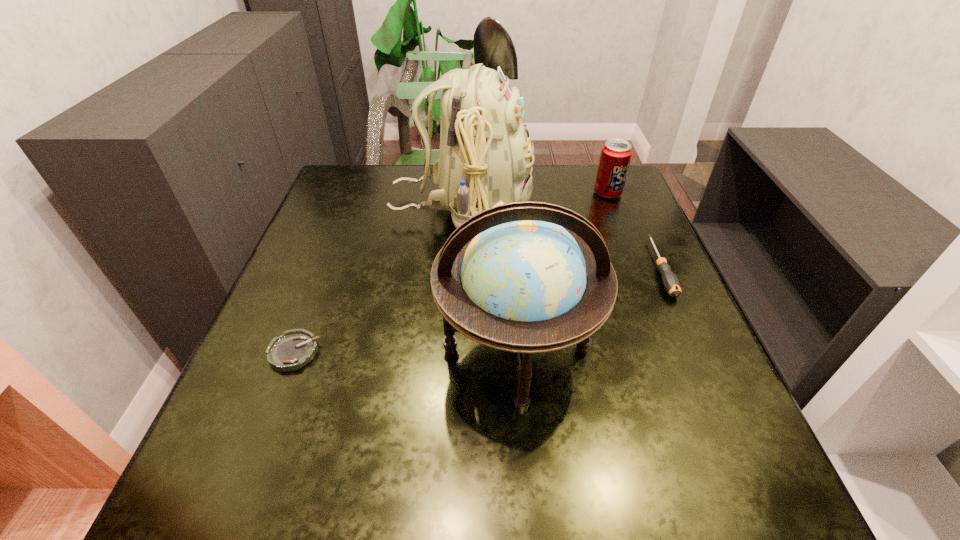
You are a GUI agent. You are given a task and a screenshot of the screen. Output one action in this format:
    pyautogui.click(x=<x>, y=<y>)
    Task: Click on the free space located 0.130m on the back of the shortest object
    Image resolution: width=960 pixels, height=540 pixels.
    Given the screenshot: What is the action you would take?
    pyautogui.click(x=319, y=287)

The width and height of the screenshot is (960, 540). Find the location of `backpack that is positioned at the far edge`. backpack that is positioned at the far edge is located at coordinates (485, 160).

Where is `soda can at the far edge`? The image size is (960, 540). soda can at the far edge is located at coordinates (616, 154).

Identify the location of object positioned at the left edge. Image resolution: width=960 pixels, height=540 pixels. (295, 348).

This screenshot has height=540, width=960. Identify the location of soda can that is positioned at the right edge. (616, 154).

The width and height of the screenshot is (960, 540). I want to click on screwdriver situated at the right edge, so click(671, 283).

The height and width of the screenshot is (540, 960). In order to click on object that is at the far right corner in this screenshot , I will do tap(616, 154).

Identify the location of free space at the far edge of the desktop. The height and width of the screenshot is (540, 960). (414, 176).

Locate an element on the screen. This screenshot has width=960, height=540. free space at the near edge of the desktop is located at coordinates (603, 501).

Where is `vacant space at the left edge of the desktop`? vacant space at the left edge of the desktop is located at coordinates (301, 282).